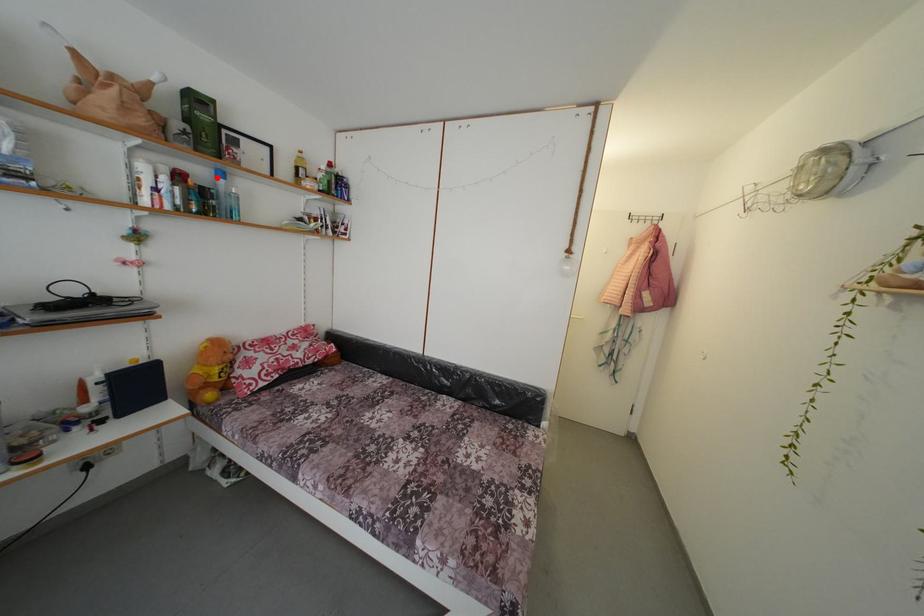
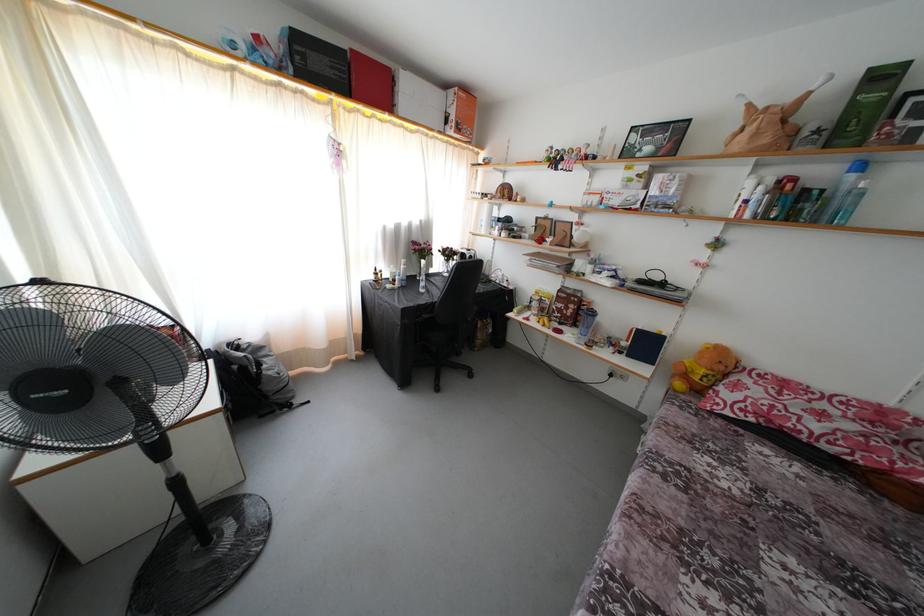
Question: I am providing you with two images of the same scene from different viewpoints. Given a red point in image1, look at the same physical point in image2. Is it:

Choices:
 (A) Closer to the viewpoint
 (B) Farther from the viewpoint

Answer: (B)